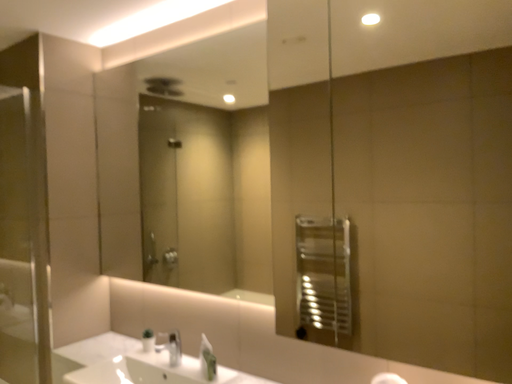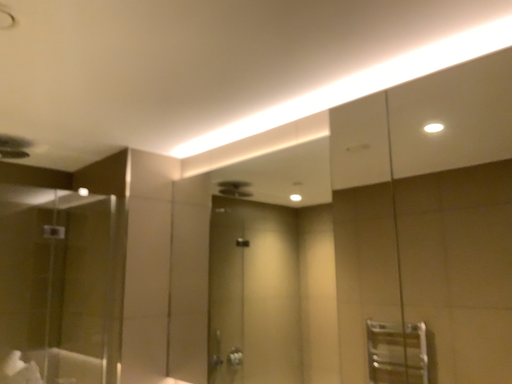
Question: Which way did the camera rotate in the video?

Choices:
 (A) rotated upward
 (B) rotated downward

Answer: (A)